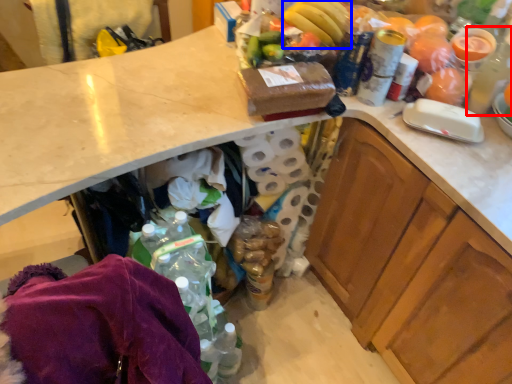
Question: Which object is closer to the camera taking this photo, bottle (highlighted by a red box) or banana (highlighted by a blue box)?

Choices:
 (A) bottle
 (B) banana

Answer: (A)